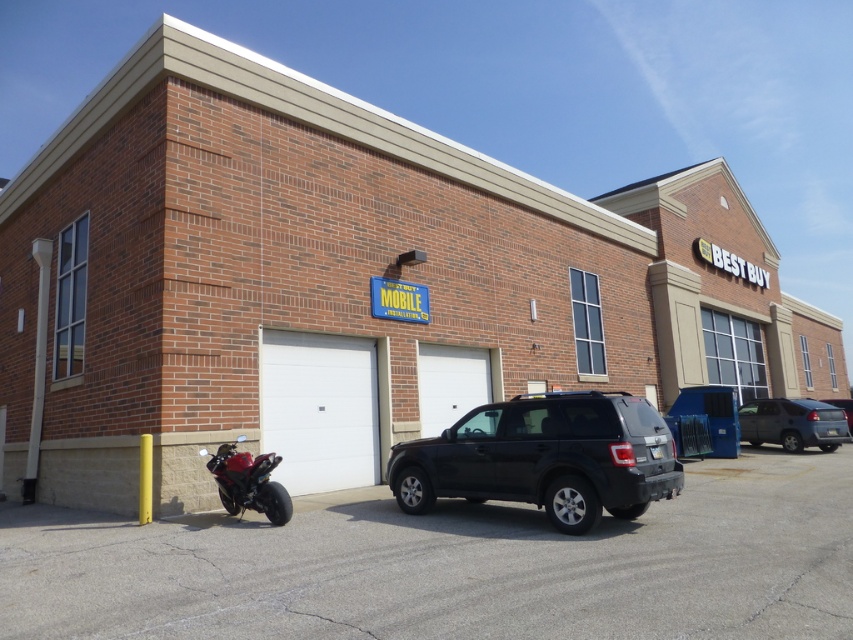
You are a delivery driver who needs to unload a package from your truck. You see the smooth asphalt parking lot at lower center and the black matte suv at center. Which surface can you safely place the package on?

The smooth asphalt parking lot at lower center has a lesser height compared to the black matte suv at center, so you can safely place the package on the smooth asphalt parking lot at lower center.

You are a delivery driver arriving at the commercial building. You need to park your vehicle in the parking lot. Can you tell me the position of the shiny red motorcycle at lower left relative to the smooth asphalt parking lot at lower center?

The smooth asphalt parking lot at lower center is in front of the shiny red motorcycle at lower left, meaning the motorcycle is behind the parking lot area.

You are standing at the entrance of the commercial building and want to park your car in the parking lot. The dark gray matte suv at right is blocking the parking spot you want. Can you estimate how far you need to move to the left or right to avoid it?

The dark gray matte suv at right is located at point (792,422). To avoid it, you should move to the left since the SUV is positioned towards the right side of the parking lot.